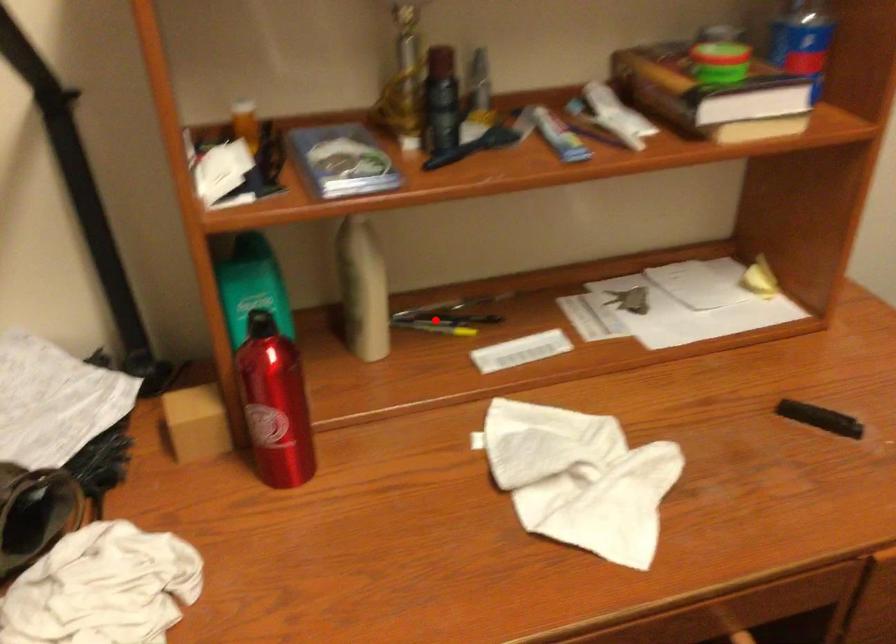
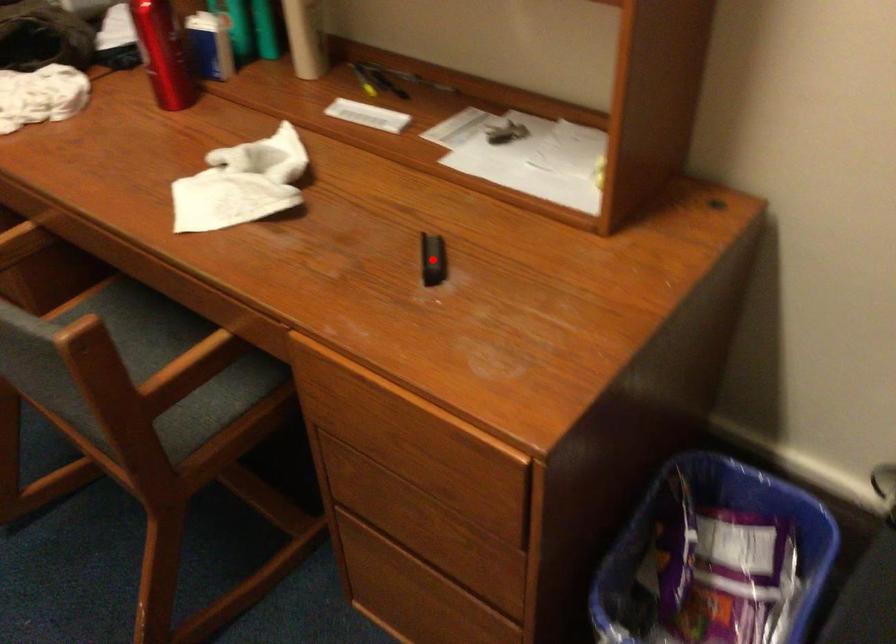
I am providing you with two images of the same scene from different viewpoints. A red point is marked on the first image and another point is marked on the second image. Do the highlighted points in image1 and image2 indicate the same real-world spot?

No